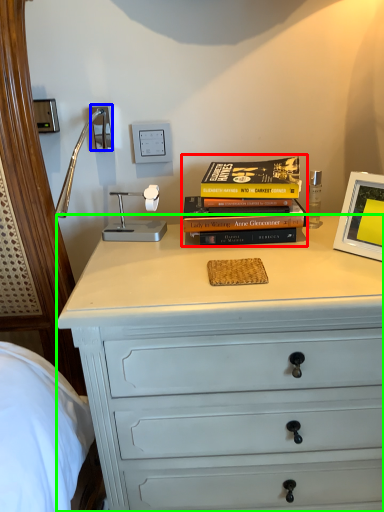
Question: Based on their relative distances, which object is farther from book (highlighted by a red box)? Choose from electric outlet (highlighted by a blue box) and chest of drawers (highlighted by a green box).

Choices:
 (A) electric outlet
 (B) chest of drawers

Answer: (A)